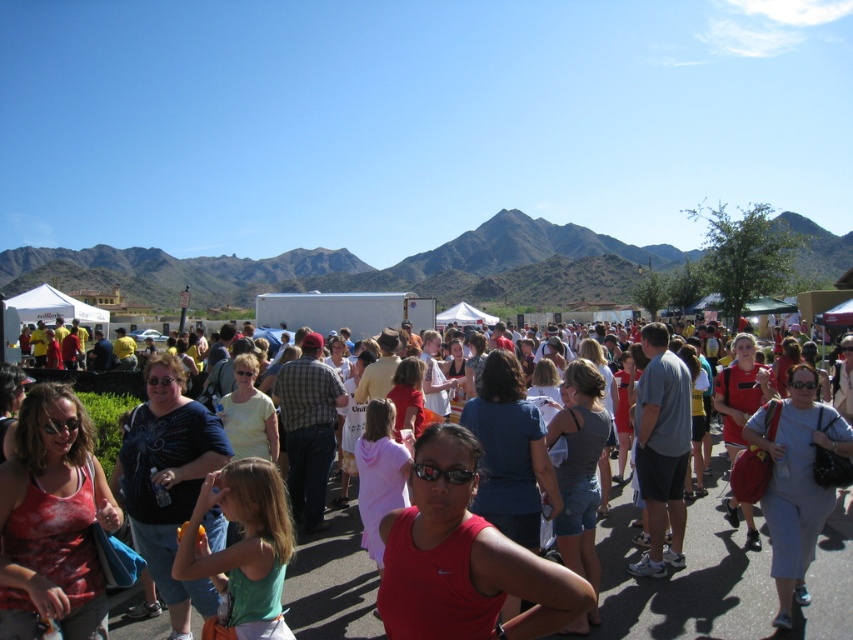
Can you confirm if green grassy mountain at upper center is thinner than matte red tank top at center?

Incorrect, green grassy mountain at upper center's width is not less than matte red tank top at center's.

This screenshot has width=853, height=640. Describe the element at coordinates (367, 268) in the screenshot. I see `green grassy mountain at upper center` at that location.

Find the location of a particular element. The height and width of the screenshot is (640, 853). green grassy mountain at upper center is located at coordinates (367, 268).